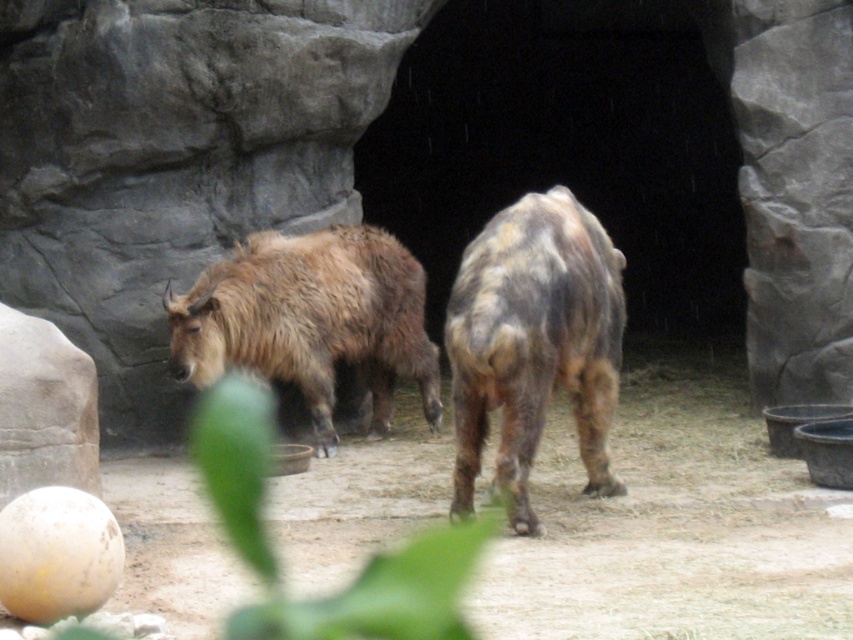
You are a zookeeper who needs to ensure the takins have enough space. The enclosure requires that each takin has at least 6 feet of personal space. Based on the image, can both brown fuzzy yak at center and fuzzy brown yak at center meet this requirement?

The distance between brown fuzzy yak at center and fuzzy brown yak at center is 7.03 feet, which exceeds the required 6 feet of personal space. Therefore, both takins meet the enclosure requirements.